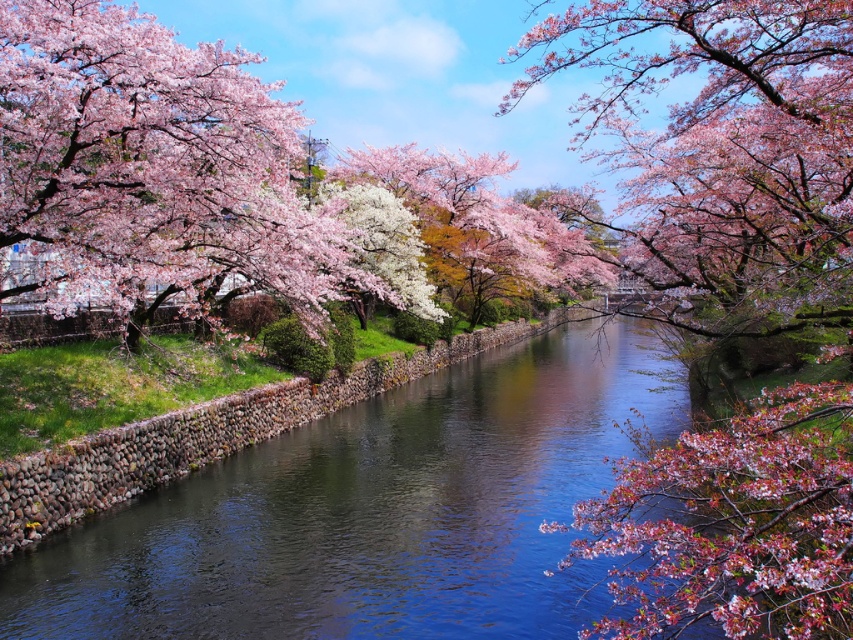
Does pink blossoms at center have a lesser height compared to clear water at center?

No, pink blossoms at center is not shorter than clear water at center.

Does pink blossoms at center have a greater height compared to clear water at center?

Indeed, pink blossoms at center has a greater height compared to clear water at center.

Find the location of a particular element. The image size is (853, 640). pink blossoms at center is located at coordinates (724, 154).

Locate an element on the screen. pink blossoms at center is located at coordinates (724, 154).